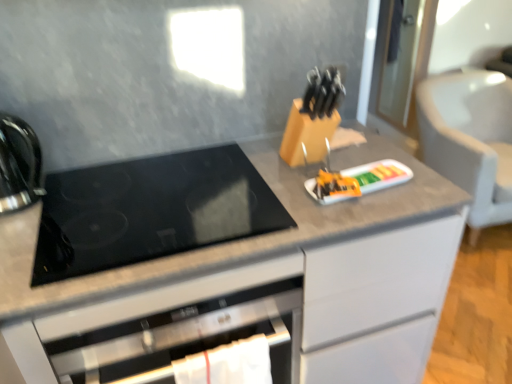
Question: Should I look upward or downward to see black glass cooktop at center?

Choices:
 (A) down
 (B) up

Answer: (A)

Question: Is orange plastic tray at center at the left side of shiny black kettle at left?

Choices:
 (A) yes
 (B) no

Answer: (B)

Question: Considering the relative sizes of orange plastic tray at center and shiny black kettle at left in the image provided, is orange plastic tray at center thinner than shiny black kettle at left?

Choices:
 (A) no
 (B) yes

Answer: (B)

Question: Considering the relative sizes of orange plastic tray at center and shiny black kettle at left in the image provided, is orange plastic tray at center bigger than shiny black kettle at left?

Choices:
 (A) yes
 (B) no

Answer: (B)

Question: Can you confirm if orange plastic tray at center is wider than shiny black kettle at left?

Choices:
 (A) no
 (B) yes

Answer: (A)

Question: Is the depth of orange plastic tray at center less than that of shiny black kettle at left?

Choices:
 (A) yes
 (B) no

Answer: (B)

Question: Is orange plastic tray at center positioned behind shiny black kettle at left?

Choices:
 (A) no
 (B) yes

Answer: (B)

Question: Is gray fabric armchair at right further to camera compared to orange plastic tray at center?

Choices:
 (A) yes
 (B) no

Answer: (A)

Question: Is gray fabric armchair at right next to orange plastic tray at center and touching it?

Choices:
 (A) yes
 (B) no

Answer: (B)

Question: Is gray fabric armchair at right taller than orange plastic tray at center?

Choices:
 (A) yes
 (B) no

Answer: (A)

Question: From the image's perspective, is gray fabric armchair at right above orange plastic tray at center?

Choices:
 (A) no
 (B) yes

Answer: (B)

Question: Could you tell me if gray fabric armchair at right is turned towards orange plastic tray at center?

Choices:
 (A) yes
 (B) no

Answer: (B)

Question: From a real-world perspective, is gray fabric armchair at right located higher than orange plastic tray at center?

Choices:
 (A) yes
 (B) no

Answer: (B)

Question: Is black glass cooktop at center at the left side of shiny black kettle at left?

Choices:
 (A) yes
 (B) no

Answer: (B)